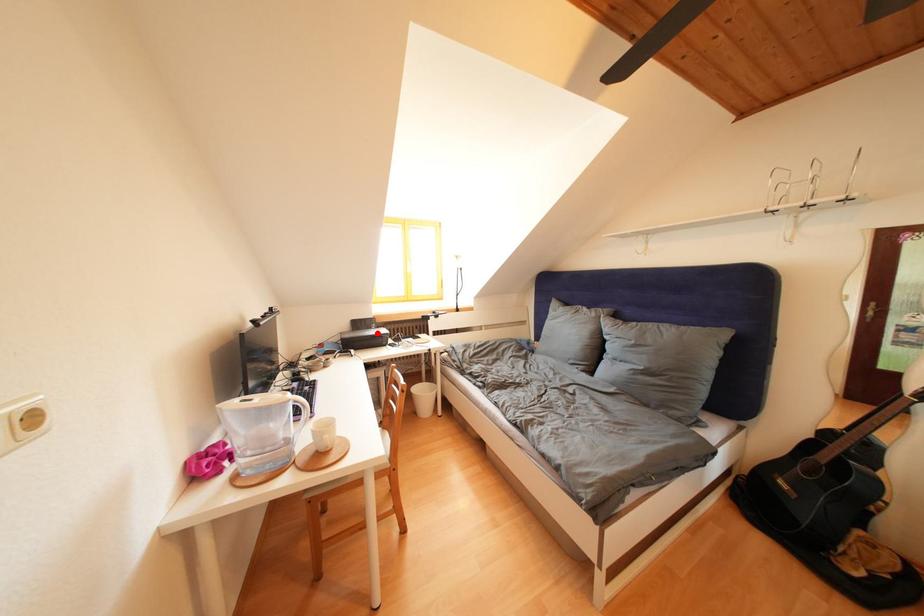
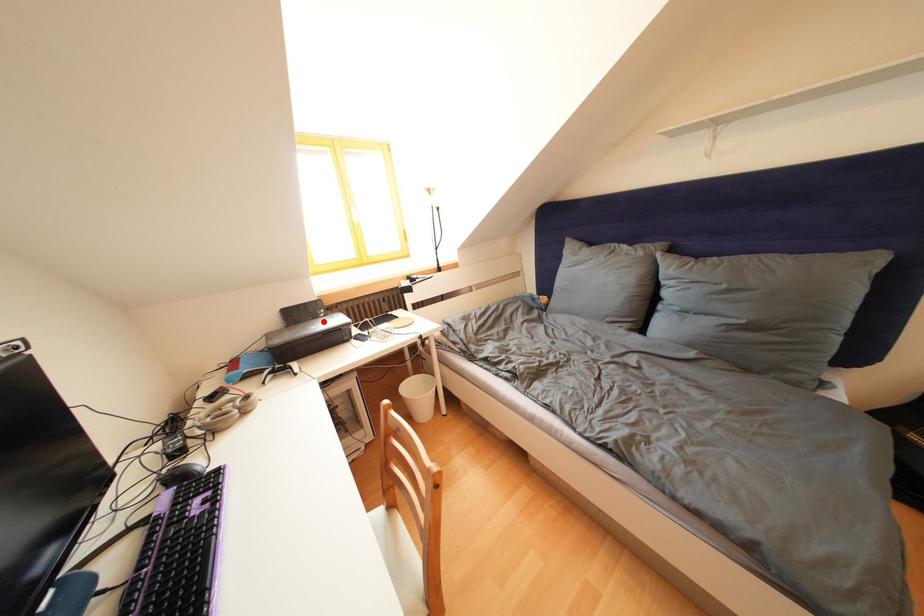
I am providing you with two images of the same scene from different viewpoints. A red point is marked on the first image and another point is marked on the second image. Are the points marked in image1 and image2 representing the same 3D position?

Yes